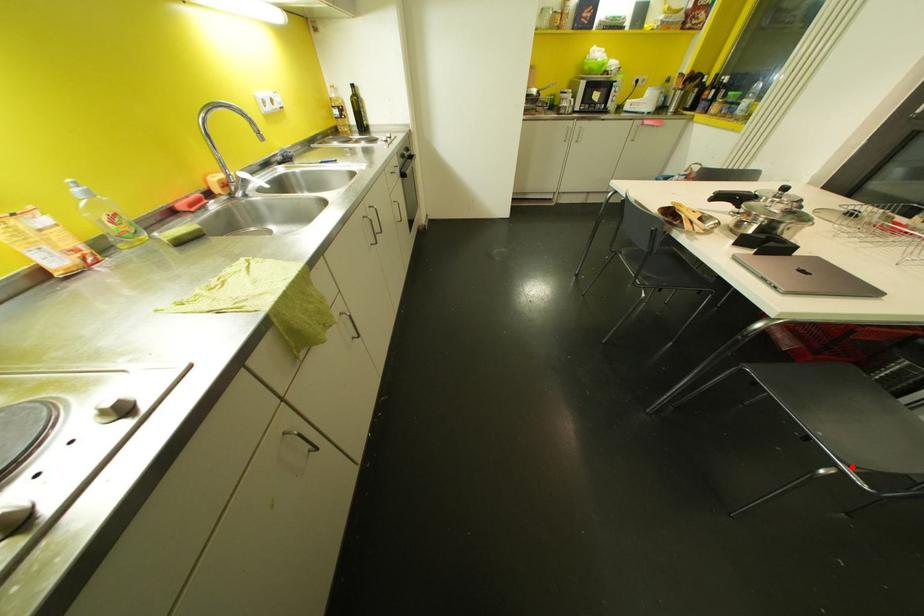
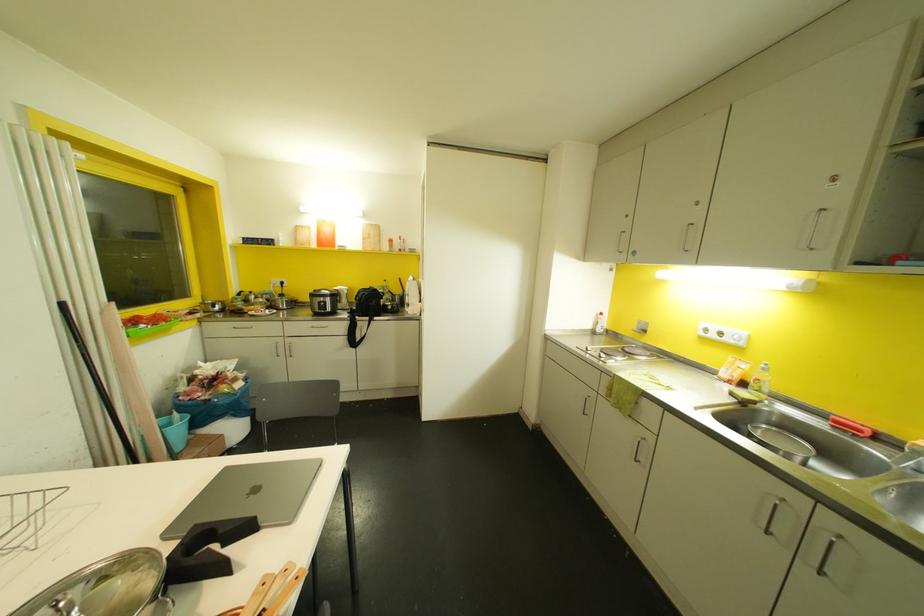
Question: I am providing you with two images of the same scene from different viewpoints. A red point is marked on the first image. Is the red point's position out of view in image 2?

Choices:
 (A) Yes
 (B) No

Answer: (A)